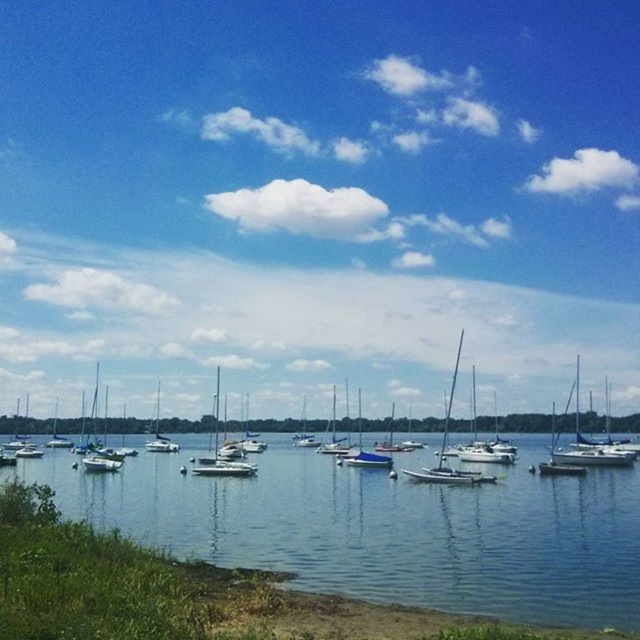
You are standing on the lakeside and want to take a photo of the white matte sailboat at left and the clear blue water at lower center. Based on their positions, which object should you frame first in your camera viewfinder to ensure both are in the shot?

You should frame the white matte sailboat at left first because the clear blue water at lower center is to the right of it, so positioning the sailboat on the left side of the frame will allow the water to naturally fit to its right.

You are standing on the lakeside and want to take a photo of the clear blue water at lower center and the white sailboat at right. Based on their positions, which object should you frame first in your camera to ensure both are in the shot?

The clear blue water at lower center should be framed first since it is positioned to the left of the white sailboat at right, ensuring both are included in the photo.